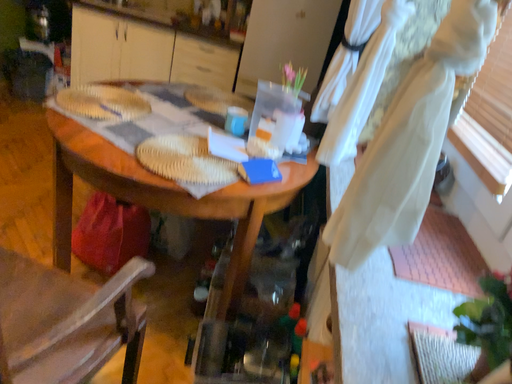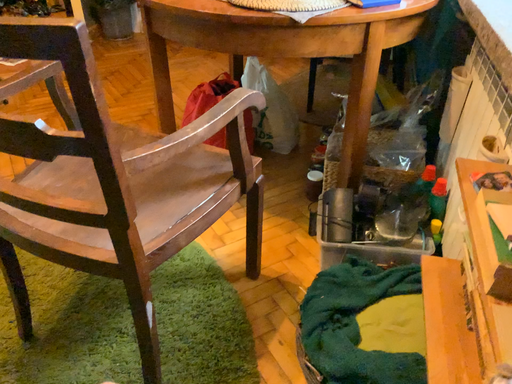
Question: Which way did the camera rotate in the video?

Choices:
 (A) rotated downward
 (B) rotated upward

Answer: (A)